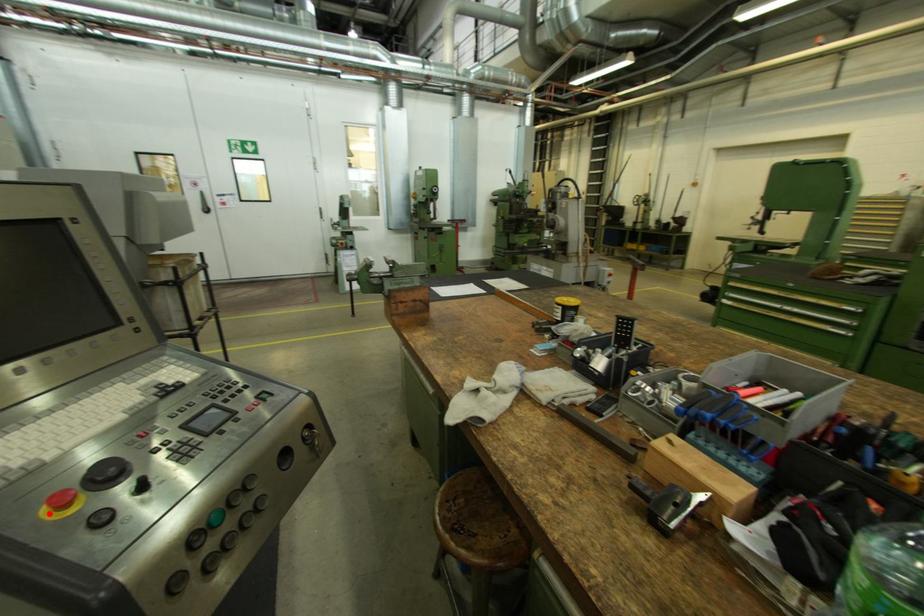
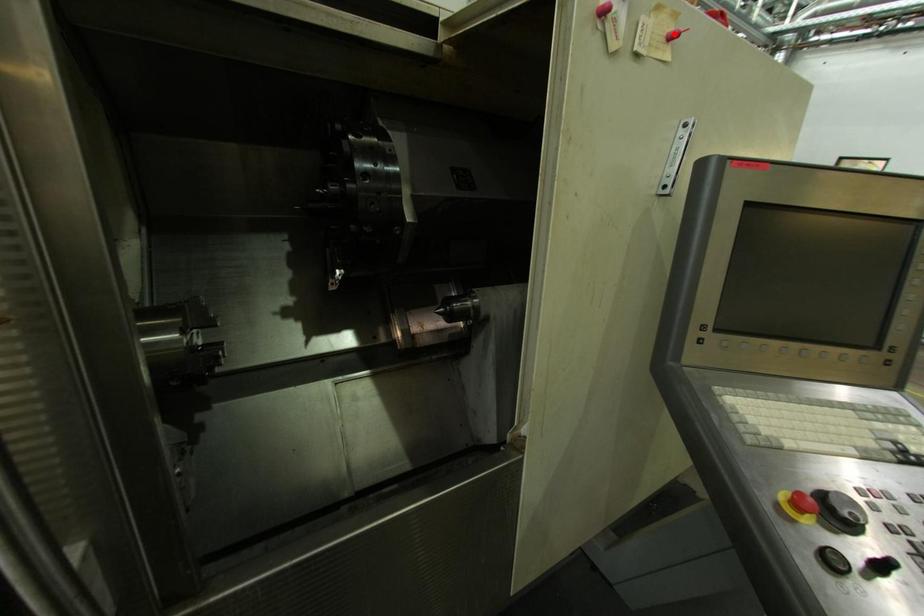
I am providing you with two images of the same scene from different viewpoints. A red point is marked on the first image and another point is marked on the second image. Do the highlighted points in image1 and image2 indicate the same real-world spot?

No